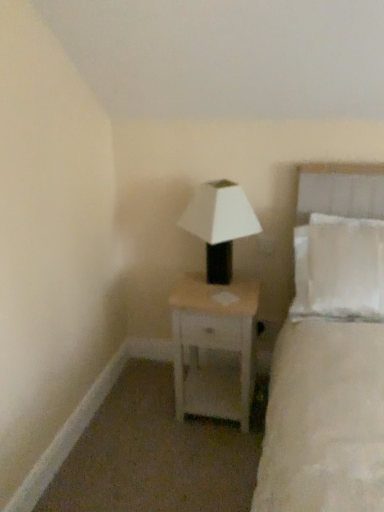
Locate an element on the screen. This screenshot has width=384, height=512. empty space that is ontop of white matte nightstand at center (from a real-world perspective) is located at coordinates (221, 289).